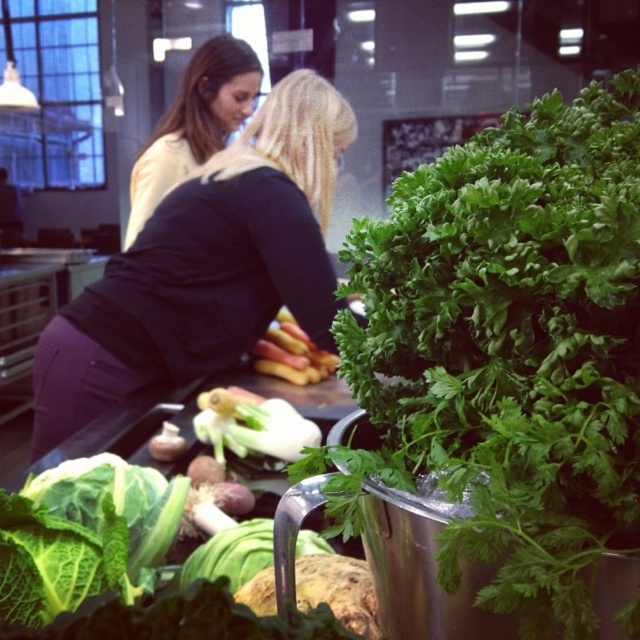
Which is behind, point (598, 518) or point (109, 384)?

Positioned behind is point (109, 384).

Can you confirm if green leafy parsley at center is positioned below black matte shirt at upper center?

Indeed, green leafy parsley at center is positioned under black matte shirt at upper center.

The width and height of the screenshot is (640, 640). Find the location of `green leafy parsley at center`. green leafy parsley at center is located at coordinates (508, 353).

Between black matte shirt at upper center and green leafy vegetable at center, which one appears on the right side from the viewer's perspective?

green leafy vegetable at center

Between black matte shirt at upper center and green leafy vegetable at center, which one has more height?

black matte shirt at upper center

Is point (116, 353) positioned in front of point (230, 547)?

No, (116, 353) is further to viewer.

In order to click on black matte shirt at upper center in this screenshot , I will do `click(205, 266)`.

Which is in front, point (193, 321) or point (237, 435)?

Point (237, 435) is more forward.

Is point (163, 362) farther from viewer compared to point (252, 432)?

Yes, point (163, 362) is farther from viewer.

Identify the location of black matte shirt at upper center. (205, 266).